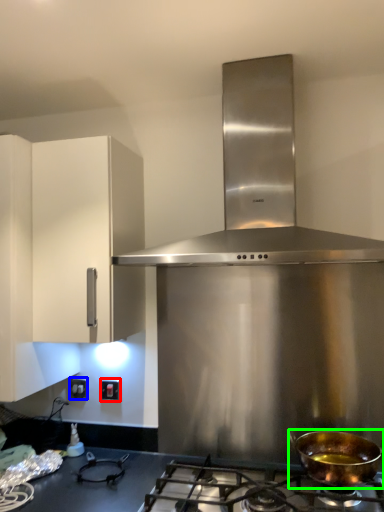
Question: Considering the real-world distances, which object is farthest from electric outlet (highlighted by a red box)? electric outlet (highlighted by a blue box) or kitchen appliance (highlighted by a green box)?

Choices:
 (A) electric outlet
 (B) kitchen appliance

Answer: (B)